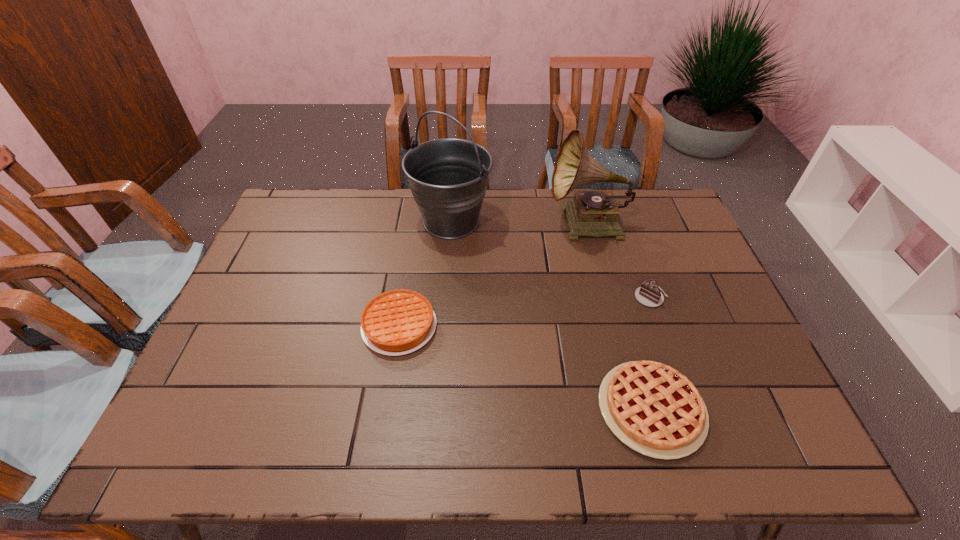
Identify the location of free space between the farther pie and the nearer pie. (525, 368).

Find the location of a particular element. The width and height of the screenshot is (960, 540). free point between the chocolate cake and the record player is located at coordinates (619, 261).

The image size is (960, 540). In order to click on the fourth closest object to the record player in this screenshot , I will do `click(652, 408)`.

Where is `object that is the closest to the left pie`? The image size is (960, 540). object that is the closest to the left pie is located at coordinates (448, 177).

At what (x,y) coordinates should I click in order to perform the action: click on free space that satisfies the following two spatial constraints: 1. on the front side of the chocolate cake; 2. on the left side of the bucket. Please return your answer as a coordinate pair (x, y). The height and width of the screenshot is (540, 960). Looking at the image, I should click on (445, 298).

You are a GUI agent. You are given a task and a screenshot of the screen. Output one action in this format:
    pyautogui.click(x=<x>, y=<y>)
    Task: Click on the vacant position in the image that satisfies the following two spatial constraints: 1. from the horn of the fourth shortest object; 2. on the front side of the farther pie
    
    Given the screenshot: What is the action you would take?
    pyautogui.click(x=613, y=326)